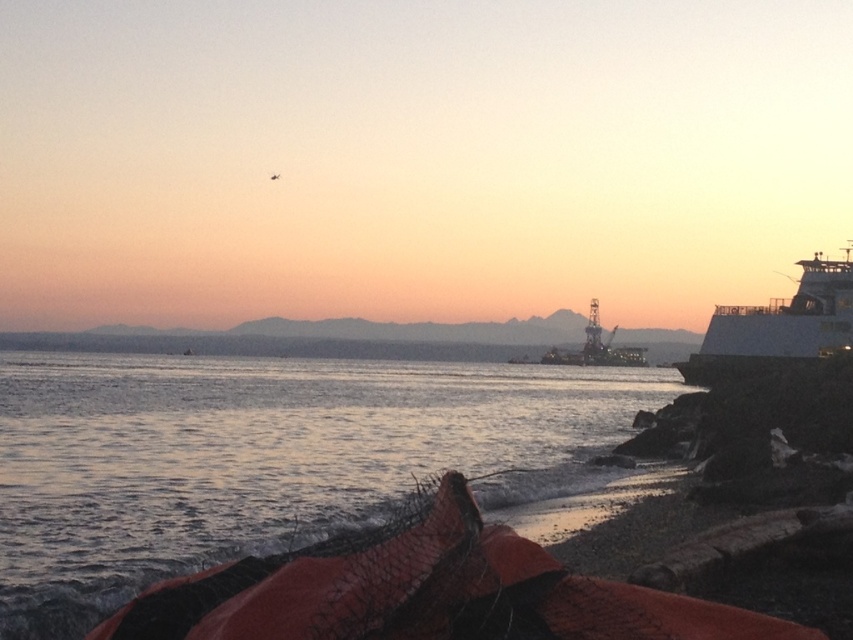
You are a marine biologist planning to board a research vessel that requires a 10 meter wide deck for equipment. You observe the white matte ferry at right and the metallic gray oil rig at center in the scene. Which one, if either, has a deck width sufficient for your equipment?

The white matte ferry at right is thinner than the metallic gray oil rig at center. Therefore, the metallic gray oil rig at center has a deck width sufficient for the equipment since it is wider than the ferry.